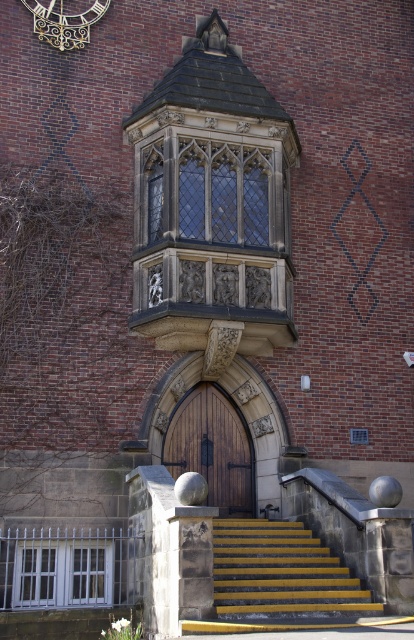
You are a delivery person trying to enter the building through the wooden door at center. However, you have a large package that requires a space larger than the door. Can you use the clear glass window at center instead?

The clear glass window at center is bigger than wooden door at center, so yes, the delivery person can use the clear glass window at center instead to pass through with the large package.